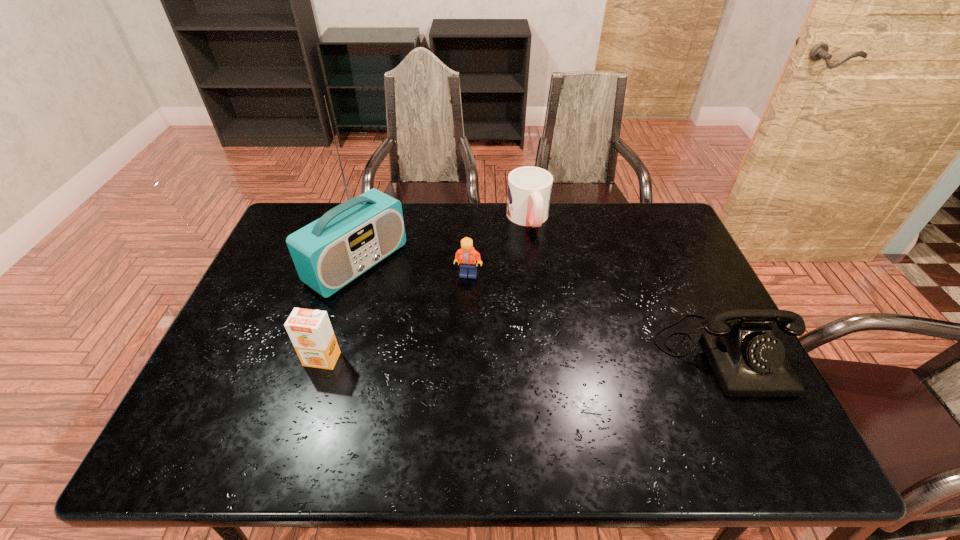
At what (x,y) coordinates should I click in order to perform the action: click on free spot on the desktop that is between the orange juice and the telephone and is positioned on the front panel of the tallest object. Please return your answer as a coordinate pair (x, y). The width and height of the screenshot is (960, 540). Looking at the image, I should click on (501, 356).

Locate an element on the screen. This screenshot has height=540, width=960. free spot on the desktop that is between the orange juice and the rightmost object and is positioned on the front-facing side of the third object from left to right is located at coordinates (492, 356).

Find the location of a particular element. This screenshot has width=960, height=540. vacant spot on the desktop that is between the orange juice and the rightmost object and is positioned on the side of the fourth object from left to right with the handle is located at coordinates (582, 355).